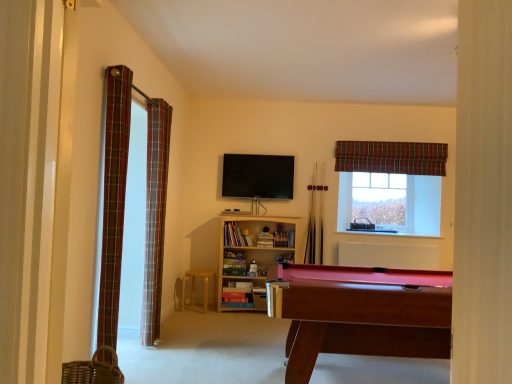
Question: From the image's perspective, is flat screen tv at center above or below wooden pool cue at center, which appears as the 2th cue when viewed from the right?

Choices:
 (A) above
 (B) below

Answer: (A)

Question: Based on their positions, is flat screen tv at center located to the left or right of wooden pool cue at center, which appears as the 2th cue when viewed from the right?

Choices:
 (A) right
 (B) left

Answer: (B)

Question: Estimate the real-world distances between objects in this image. Which object is closer to the clear glass window at upper right?

Choices:
 (A) plaid fabric curtain at left, the first curtain positioned from the front
 (B) plaid fabric curtain at upper right, which is counted as the first curtain, starting from the back
 (C) plaid fabric curtain at left, the second curtain in the left-to-right sequence
 (D) wooden billiard table at lower right
 (E) wooden pool cue at center, positioned as the first cue in right-to-left order

Answer: (B)

Question: Which is nearer to the plaid fabric curtain at left, which is the second curtain in back-to-front order?

Choices:
 (A) flat screen tv at center
 (B) wooden billiard table at lower right
 (C) wooden bookshelf at center
 (D) wooden pool cue at center, which appears as the 1th cue when viewed from the left
 (E) wooden pool cue at center, which is the second cue in left-to-right order

Answer: (C)